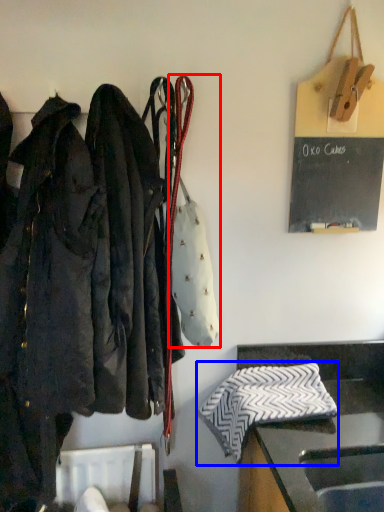
Question: Which point is further to the camera, handbag (highlighted by a red box) or cloth (highlighted by a blue box)?

Choices:
 (A) handbag
 (B) cloth

Answer: (B)